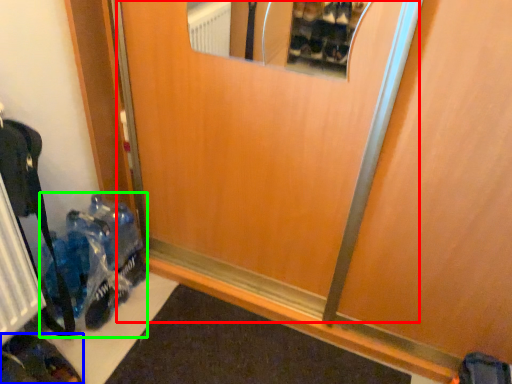
Question: Which is nearer to the elevator door (highlighted by a red box)? footwear (highlighted by a blue box) or toy (highlighted by a green box).

Choices:
 (A) footwear
 (B) toy

Answer: (B)